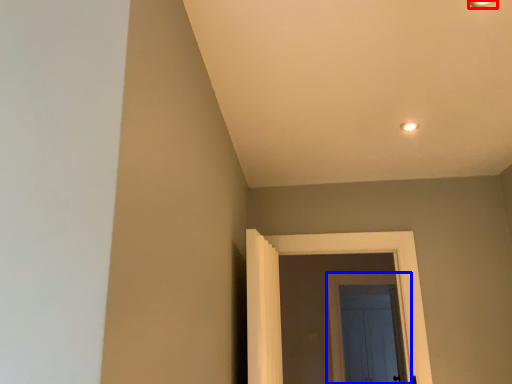
Question: Among these objects, which one is farthest to the camera, light fixture (highlighted by a red box) or door (highlighted by a blue box)?

Choices:
 (A) light fixture
 (B) door

Answer: (B)